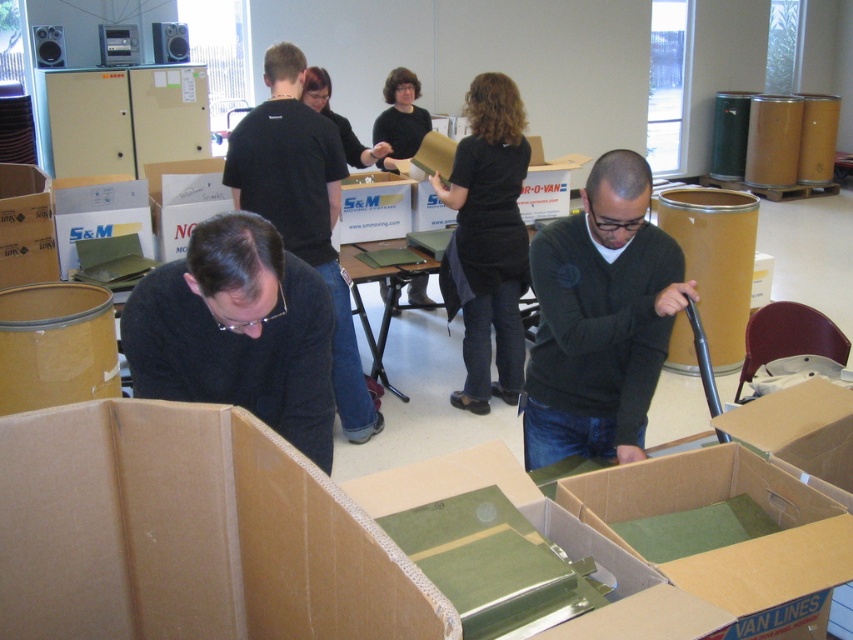
Question: Which of the following is the closest to the observer?

Choices:
 (A) (548, 262)
 (B) (82, 228)
 (C) (0, 230)
 (D) (511, 340)

Answer: (A)

Question: Which point is farther to the camera?

Choices:
 (A) (283, 141)
 (B) (120, 323)
 (C) (67, 204)

Answer: (C)

Question: Which object is the farthest from the black matte shirt at upper center?

Choices:
 (A) dark green sweater at center
 (B) cardboard box at left
 (C) matte black shirt at center

Answer: (C)

Question: Is dark green sweater at center to the left of black matte sweater at lower left from the viewer's perspective?

Choices:
 (A) no
 (B) yes

Answer: (A)

Question: Does dark green sweater at center have a greater width compared to black matte shirt at center?

Choices:
 (A) yes
 (B) no

Answer: (B)

Question: Is black matte sweater at lower left wider than black matte shirt at upper center?

Choices:
 (A) yes
 (B) no

Answer: (B)